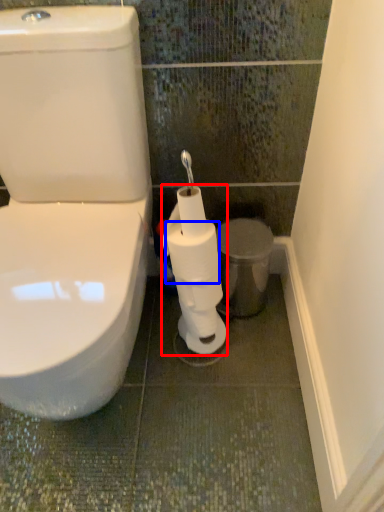
Question: Among these objects, which one is farthest to the camera, toilet paper (highlighted by a red box) or toilet paper (highlighted by a blue box)?

Choices:
 (A) toilet paper
 (B) toilet paper

Answer: (B)